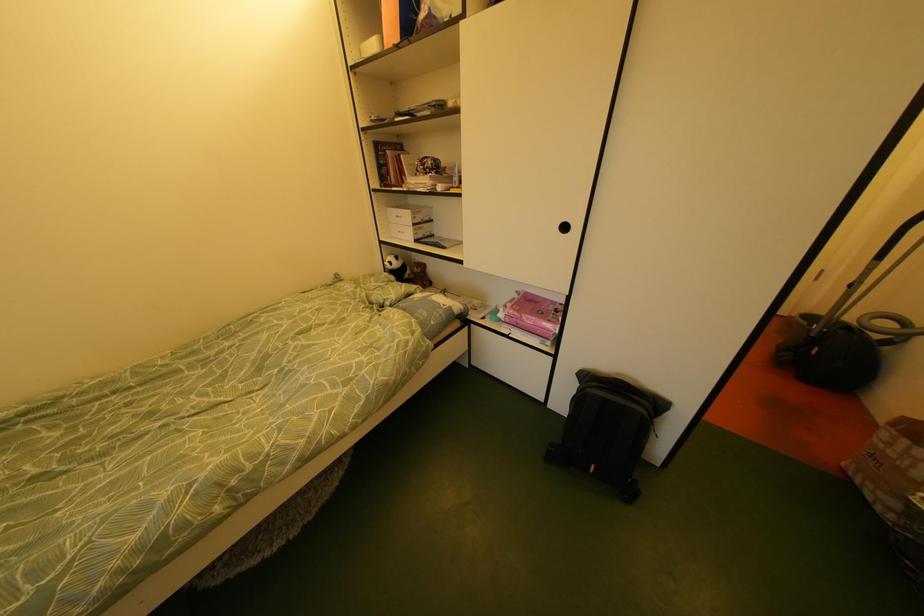
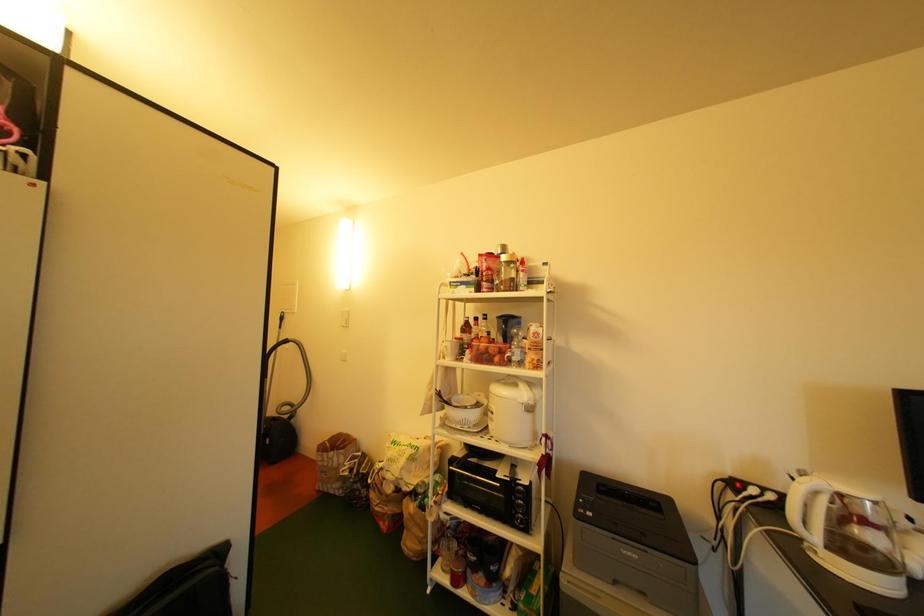
Question: The camera is either moving clockwise (left) or counter-clockwise (right) around the object. The first image is from the beginning of the video and the second image is from the end. Is the camera moving left or right when shooting the video?

Choices:
 (A) Left
 (B) Right

Answer: (A)